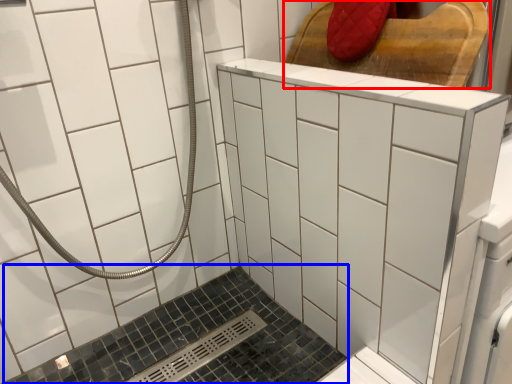
Question: Among these objects, which one is nearest to the camera, furniture (highlighted by a red box) or bath (highlighted by a blue box)?

Choices:
 (A) furniture
 (B) bath

Answer: (B)